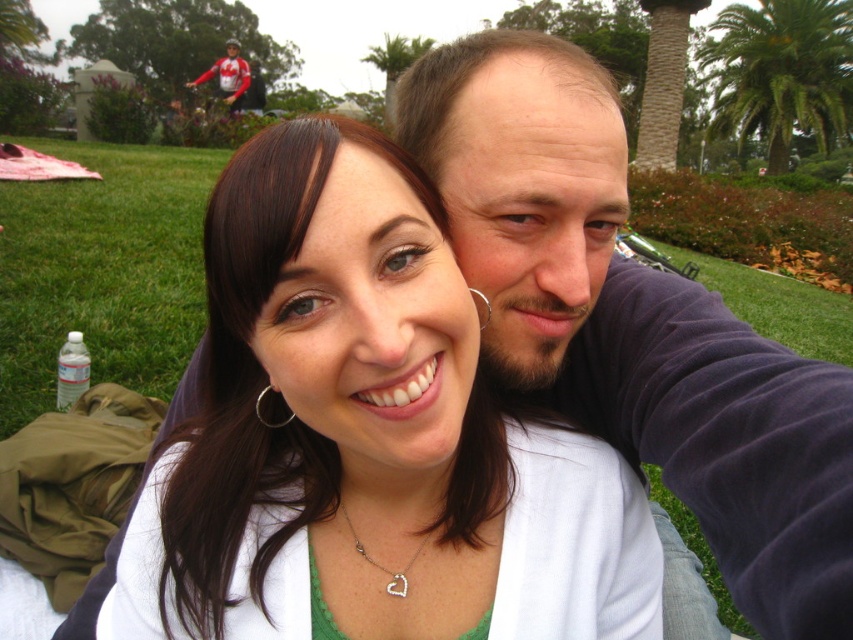
Which is above, silver heart-shaped pendant at center or silver metallic earring at center-left?

silver metallic earring at center-left is higher up.

Can you confirm if silver heart-shaped pendant at center is wider than silver metallic earring at center-left?

Correct, the width of silver heart-shaped pendant at center exceeds that of silver metallic earring at center-left.

You are a GUI agent. You are given a task and a screenshot of the screen. Output one action in this format:
    pyautogui.click(x=<x>, y=<y>)
    Task: Click on the silver heart-shaped pendant at center
    
    Given the screenshot: What is the action you would take?
    pyautogui.click(x=381, y=564)

Locate an element on the screen. The width and height of the screenshot is (853, 640). silver heart-shaped pendant at center is located at coordinates (381, 564).

Looking at this image, is matte white shirt at center positioned before green grass at lower left?

Yes, matte white shirt at center is in front of green grass at lower left.

Where is `matte white shirt at center`? The width and height of the screenshot is (853, 640). matte white shirt at center is located at coordinates [364, 436].

Is green grass at lower left above silver heart-shaped pendant at center?

Correct, green grass at lower left is located above silver heart-shaped pendant at center.

In the scene shown: Between green grass at lower left and silver heart-shaped pendant at center, which one has more height?

green grass at lower left

Is point (144, 188) in front of point (352, 524)?

That is False.

The width and height of the screenshot is (853, 640). I want to click on green grass at lower left, so click(x=102, y=269).